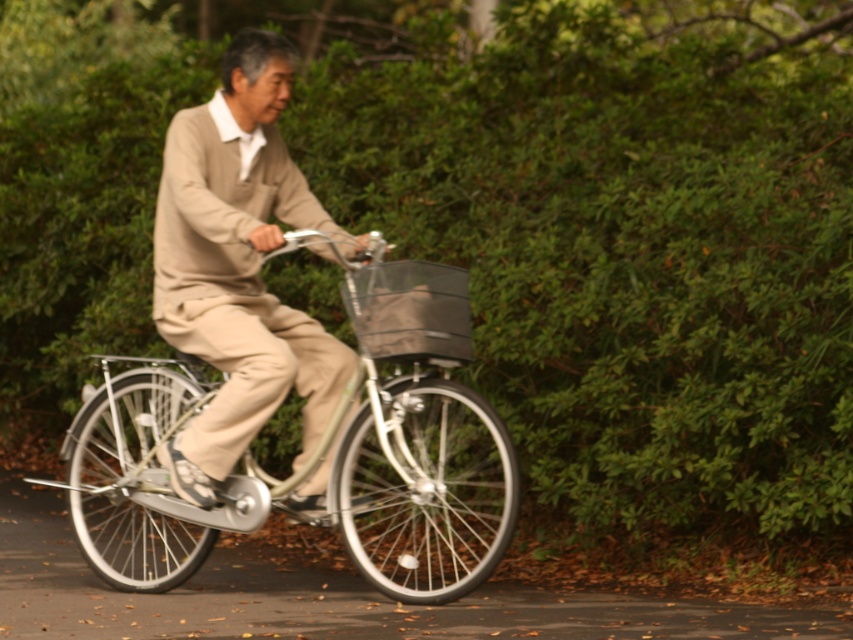
You are a photographer trying to capture a portrait of the person riding the silver metallic bicycle at center. Since the beige wool sweater at center is covering part of the bicycle, will you need to adjust your camera angle to get a clear shot of the bicycle?

The silver metallic bicycle at center is not as tall as the beige wool sweater at center, so the sweater may be blocking part of the bicycle. To get a clear shot of the silver metallic bicycle at center, you should adjust your camera angle to avoid the obstruction caused by the taller beige wool sweater at center.

You are a photographer capturing the scene of a person riding a bicycle. You notice the beige wool sweater at center and the matte gray fabric basket at center. Which object is positioned in front of the other from your perspective?

The beige wool sweater at center is closer to the viewer than the matte gray fabric basket at center, so the beige wool sweater at center is positioned in front of the matte gray fabric basket at center.